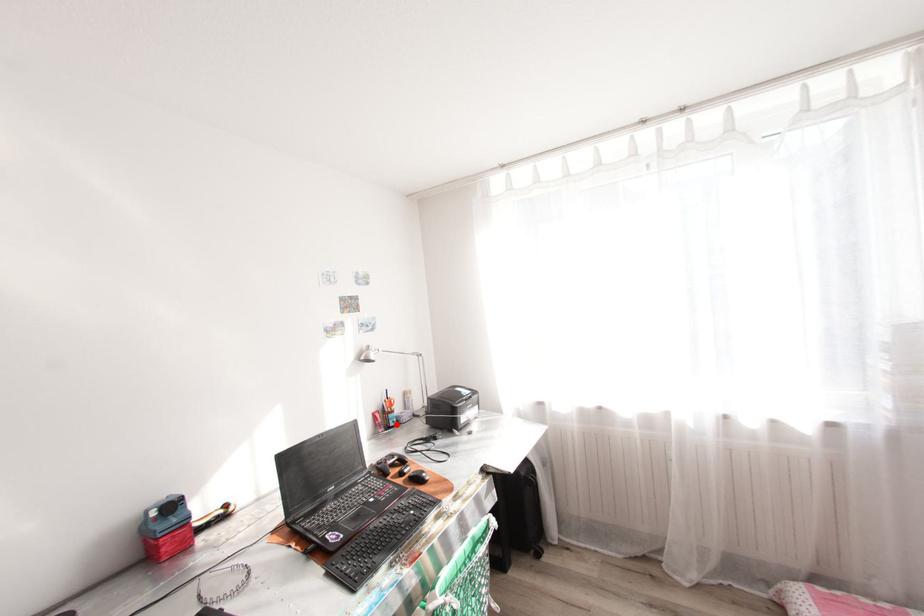
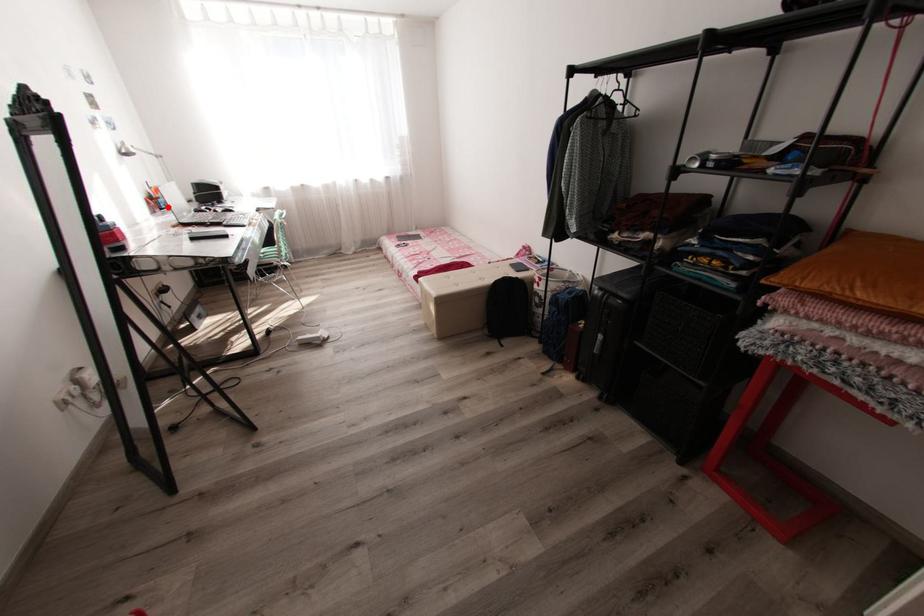
I am providing you with two images of the same scene from different viewpoints. A red point is marked on the first image and another point is marked on the second image. Are the points marked in image1 and image2 representing the same 3D position?

Yes